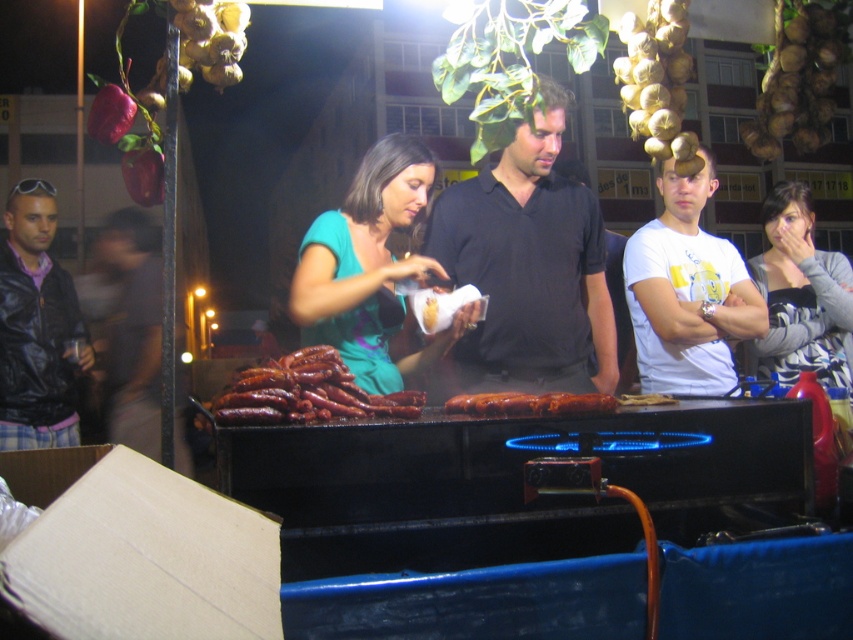
You are standing at the origin point of the coordinate system in the image. The grill is located at point 0.5, 0.5. Can you tell me the direction of the green matte shirt at center relative to the grill?

The green matte shirt at center is located at point (x=370, y=268), which is slightly to the left and below the grill at (x=426, y=320).

You are a street vendor who needs to place a new item on the table between the black leather jacket at left and the golden brown onion at upper right. Which object should you place the item closer to if you want it to be near the larger object?

The black leather jacket at left is larger than the golden brown onion at upper right, so you should place the item closer to the black leather jacket at left.